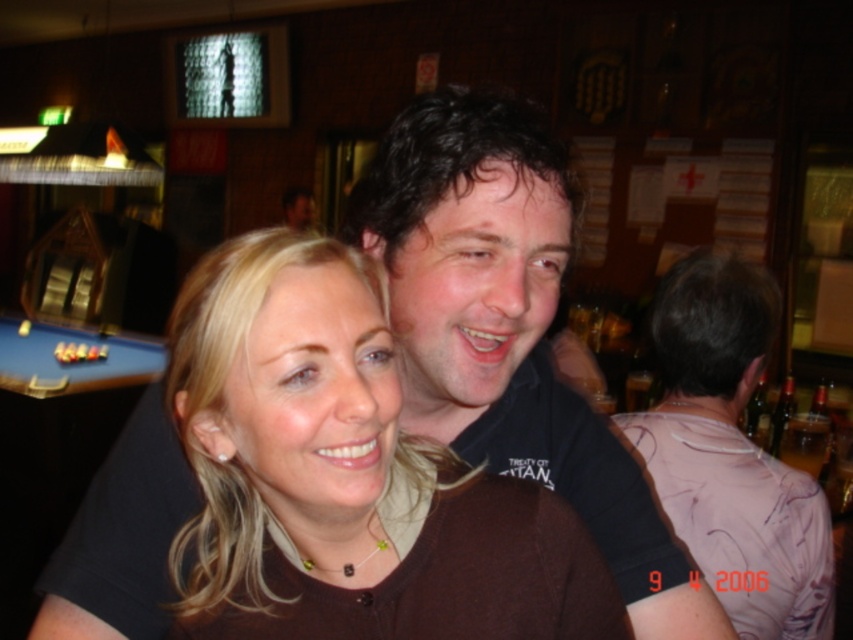
Question: From the image, what is the correct spatial relationship of brown matte shirt at center in relation to blue felt pool table at lower left?

Choices:
 (A) right
 (B) left

Answer: (A)

Question: Observing the image, what is the correct spatial positioning of brown matte shirt at center in reference to blue felt pool table at lower left?

Choices:
 (A) above
 (B) below

Answer: (B)

Question: Which point is farther to the camera?

Choices:
 (A) brown matte shirt at center
 (B) blue felt pool table at lower left

Answer: (B)

Question: Is brown matte shirt at center smaller than blue felt pool table at lower left?

Choices:
 (A) no
 (B) yes

Answer: (B)